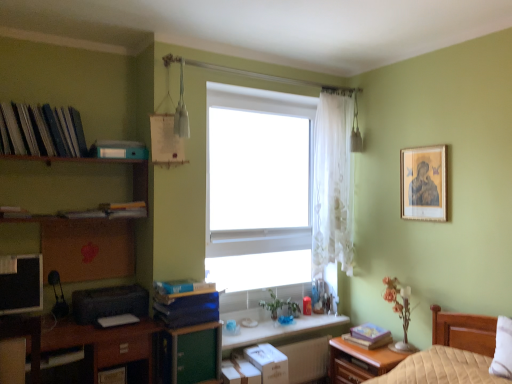
Image resolution: width=512 pixels, height=384 pixels. In order to click on matte plastic computer desk at center in this screenshot , I will do `click(279, 330)`.

Locate an element on the screen. blue matte book at lower left, the 3th book when ordered from left to right is located at coordinates (188, 310).

Measure the distance between point (385,346) and camera.

A distance of 9.66 feet exists between point (385,346) and camera.

Measure the distance between black plastic printer at lower left and camera.

A distance of 8.28 feet exists between black plastic printer at lower left and camera.

Image resolution: width=512 pixels, height=384 pixels. Find the location of `matte plastic computer desk at center`. matte plastic computer desk at center is located at coordinates (279, 330).

Which of these two, translucent glass vase at window or matte blue bookshelf at upper left, acting as the 2th book starting from the top, is wider?

With larger width is translucent glass vase at window.

Based on the photo, considering the relative sizes of translucent glass vase at window and matte blue bookshelf at upper left, acting as the 2th book starting from the top, in the image provided, is translucent glass vase at window smaller than matte blue bookshelf at upper left, acting as the 2th book starting from the top,?

Actually, translucent glass vase at window might be larger than matte blue bookshelf at upper left, acting as the 2th book starting from the top.

Is translucent glass vase at window inside or outside of matte blue bookshelf at upper left, the fourth book from the right?

translucent glass vase at window cannot be found inside matte blue bookshelf at upper left, the fourth book from the right.

Can you confirm if translucent glass vase at window is shorter than matte blue bookshelf at upper left, the fourth book from the right?

In fact, translucent glass vase at window may be taller than matte blue bookshelf at upper left, the fourth book from the right.

Is green matte file cabinet at lower left next to wooden picture frame at upper right and touching it?

No, green matte file cabinet at lower left is not touching wooden picture frame at upper right.

Is point (186, 345) closer to viewer compared to point (433, 198)?

Yes, it is.

From a real-world perspective, is green matte file cabinet at lower left physically above wooden picture frame at upper right?

Incorrect, from a real-world perspective, green matte file cabinet at lower left is lower than wooden picture frame at upper right.

What are the coordinates of `file cabinet in front of the wooden picture frame at upper right` in the screenshot? It's located at (189, 354).

Locate an element on the screen. This screenshot has width=512, height=384. nightstand below the brown wooden desk at lower left (from a real-world perspective) is located at coordinates (359, 362).

Which of these two, wooden nightstand at lower right or brown wooden desk at lower left, is wider?

Wider between the two is brown wooden desk at lower left.

Is the position of wooden nightstand at lower right more distant than that of brown wooden desk at lower left?

Yes, it is behind brown wooden desk at lower left.

Is wooden nightstand at lower right turned away from brown wooden desk at lower left?

wooden nightstand at lower right is not turned away from brown wooden desk at lower left.

Which object is thinner, hardcover book at center, placed as the 1th book when sorted from bottom to top, or matte plastic computer desk at center?

With smaller width is hardcover book at center, placed as the 1th book when sorted from bottom to top.

Are hardcover book at center, which is the first book in right-to-left order, and matte plastic computer desk at center beside each other?

No, hardcover book at center, which is the first book in right-to-left order, is not next to matte plastic computer desk at center.

Does hardcover book at center, placed as the 1th book when sorted from bottom to top, have a greater height compared to matte plastic computer desk at center?

No, hardcover book at center, placed as the 1th book when sorted from bottom to top, is not taller than matte plastic computer desk at center.

Is hardcover book at center, placed as the 1th book when sorted from bottom to top, located outside matte plastic computer desk at center?

Yes, hardcover book at center, placed as the 1th book when sorted from bottom to top, is outside of matte plastic computer desk at center.

Considering the positions of objects matte cardboard books at left, which is counted as the 5th book, starting from the right, and matte black monitor at left in the image provided, who is behind, matte cardboard books at left, which is counted as the 5th book, starting from the right, or matte black monitor at left?

matte black monitor at left is behind.

Can you tell me how much matte cardboard books at left, which is counted as the 5th book, starting from the right, and matte black monitor at left differ in facing direction?

The angle between the facing direction of matte cardboard books at left, which is counted as the 5th book, starting from the right, and the facing direction of matte black monitor at left is 0.838 degrees.

Does matte cardboard books at left, the 1th book when ordered from left to right, turn towards matte black monitor at left?

No.

From a real-world perspective, does matte cardboard books at left, which is the first book from top to bottom, sit lower than matte black monitor at left?

No, from a real-world perspective, matte cardboard books at left, which is the first book from top to bottom, is not beneath matte black monitor at left.

Is matte cardboard books at left, acting as the 5th book starting from the bottom, looking in the opposite direction of matte blue bookshelf at upper left, the fourth book from the bottom?

No, matte cardboard books at left, acting as the 5th book starting from the bottom,'s orientation is not away from matte blue bookshelf at upper left, the fourth book from the bottom.

Looking at this image, from a real-world perspective, which object rests below the other?

From a 3D spatial view, matte blue bookshelf at upper left, acting as the 2th book starting from the top, is below.

Starting from the matte blue bookshelf at upper left, the fourth book from the bottom, which book is the 3rd one in front? Please provide its 2D coordinates.

[(41, 130)]

Is matte cardboard books at left, which is counted as the 5th book, starting from the right, next to matte blue bookshelf at upper left, acting as the 2th book starting from the left?

No, matte cardboard books at left, which is counted as the 5th book, starting from the right, is not making contact with matte blue bookshelf at upper left, acting as the 2th book starting from the left.

From the image's perspective, between white sheer curtain at center and brown wooden desk at lower left, which one is located above?

white sheer curtain at center is shown above in the image.

From a real-world perspective, which object rests below the other?

brown wooden desk at lower left, from a real-world perspective.

Which object is further away from the camera, white sheer curtain at center or brown wooden desk at lower left?

Positioned behind is white sheer curtain at center.

At what (x,y) coordinates should I click in order to perform the action: click on book that is the 3rd object to the left of the translucent glass vase at window, starting at the anchor. Please return your answer as a coordinate pair (x, y). The width and height of the screenshot is (512, 384). Looking at the image, I should click on (119, 150).

The height and width of the screenshot is (384, 512). What are the coordinates of `picture frame lying behind the green matte file cabinet at lower left` in the screenshot? It's located at (423, 183).

Consider the image. Considering their positions, is matte black monitor at left positioned further to black plastic printer at lower left than matte cardboard books at left, which is counted as the 5th book, starting from the right?

Based on the image, matte cardboard books at left, which is counted as the 5th book, starting from the right, appears to be further to black plastic printer at lower left.

Based on their spatial positions, is wooden picture frame at upper right or brown wooden shelf at upper left closer to wooden nightstand at lower right?

wooden picture frame at upper right.

Looking at the image, which one is located further to brown wooden shelf at upper left, green matte file cabinet at lower left or matte plastic computer desk at center?

Among the two, matte plastic computer desk at center is located further to brown wooden shelf at upper left.

From the picture: When comparing their distances from brown wooden shelf at upper left, does blue matte book at lower left, placed as the 3th book when sorted from right to left, or green matte file cabinet at lower left seem further?

green matte file cabinet at lower left is further to brown wooden shelf at upper left.

Which object lies further to the anchor point white matte window at center, green matte file cabinet at lower left or hardcover book at center, the 5th book when ordered from top to bottom?

hardcover book at center, the 5th book when ordered from top to bottom, is positioned further to the anchor white matte window at center.

Looking at the image, which one is located closer to wooden picture frame at upper right, blue matte book at lower left, the 3th book when ordered from left to right, or brown wooden shelf at upper left?

Among the two, blue matte book at lower left, the 3th book when ordered from left to right, is located nearer to wooden picture frame at upper right.

From the image, which object appears to be farther from translucent glass vase at window, brown wooden desk at lower left or brown wooden shelf at upper left?

brown wooden shelf at upper left lies further to translucent glass vase at window than the other object.

Estimate the real-world distances between objects in this image. Which object is closer to white sheer curtain at center, wooden nightstand at lower right or translucent glass vase at window?

translucent glass vase at window is closer to white sheer curtain at center.

You are a GUI agent. You are given a task and a screenshot of the screen. Output one action in this format:
    pyautogui.click(x=<x>, y=<y>)
    Task: Click on the file cabinet between black plastic printer at lower left and hardcover book at center, which is the first book in right-to-left order
    This screenshot has height=384, width=512.
    Given the screenshot: What is the action you would take?
    pyautogui.click(x=189, y=354)

Find the location of a particular element. The height and width of the screenshot is (384, 512). computer desk located between brown wooden desk at lower left and wooden nightstand at lower right in the left-right direction is located at coordinates click(279, 330).

Identify the location of curtain located between brown wooden desk at lower left and hardcover book at center, which is the first book in right-to-left order, in the left-right direction. (332, 183).

Where is `shelf between matte cardboard books at left, which is counted as the 5th book, starting from the right, and green matte file cabinet at lower left, in the vertical direction`? shelf between matte cardboard books at left, which is counted as the 5th book, starting from the right, and green matte file cabinet at lower left, in the vertical direction is located at coordinates (70, 182).